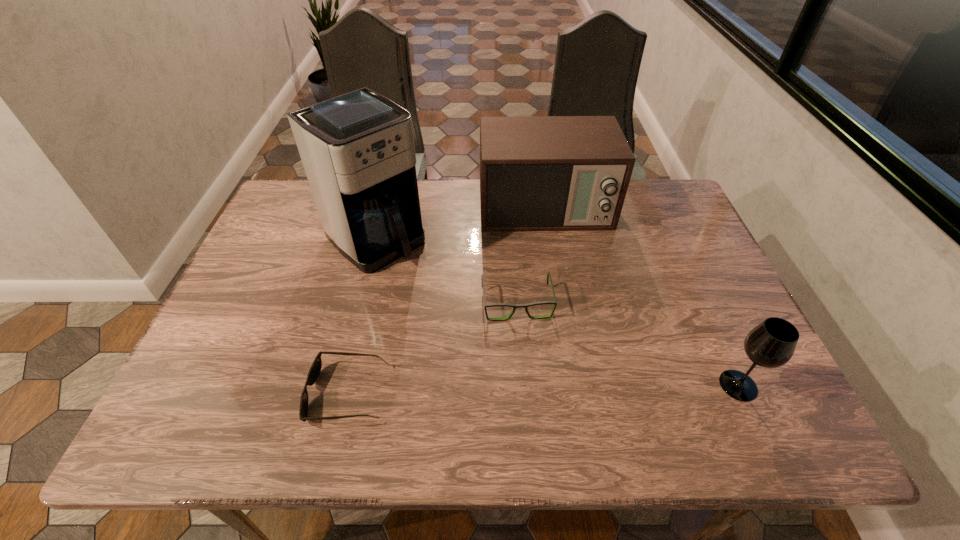
Image resolution: width=960 pixels, height=540 pixels. I want to click on vacant space located 0.070m on the back of the rightmost object, so click(719, 342).

This screenshot has height=540, width=960. Find the location of `vacant space located 0.080m on the lens of the spectacles`. vacant space located 0.080m on the lens of the spectacles is located at coordinates (524, 349).

Locate an element on the screen. vacant space located 0.050m on the lens of the spectacles is located at coordinates (523, 339).

Image resolution: width=960 pixels, height=540 pixels. In order to click on vacant space located on the lens of the spectacles in this screenshot , I will do `click(532, 398)`.

This screenshot has height=540, width=960. Find the location of `free space located 0.110m on the front panel of the coffee maker`. free space located 0.110m on the front panel of the coffee maker is located at coordinates (431, 286).

Where is `free space located 0.160m on the front panel of the coffee maker`? The width and height of the screenshot is (960, 540). free space located 0.160m on the front panel of the coffee maker is located at coordinates (444, 297).

The image size is (960, 540). What are the coordinates of `blank area located 0.220m on the front panel of the coffee maker` in the screenshot? It's located at (459, 310).

Image resolution: width=960 pixels, height=540 pixels. What are the coordinates of `vacant space located on the front-facing side of the fourth shortest object` in the screenshot? It's located at (572, 350).

The width and height of the screenshot is (960, 540). I want to click on vacant space located on the front-facing side of the fourth shortest object, so click(564, 309).

This screenshot has height=540, width=960. I want to click on vacant space situated on the front-facing side of the fourth shortest object, so click(x=555, y=264).